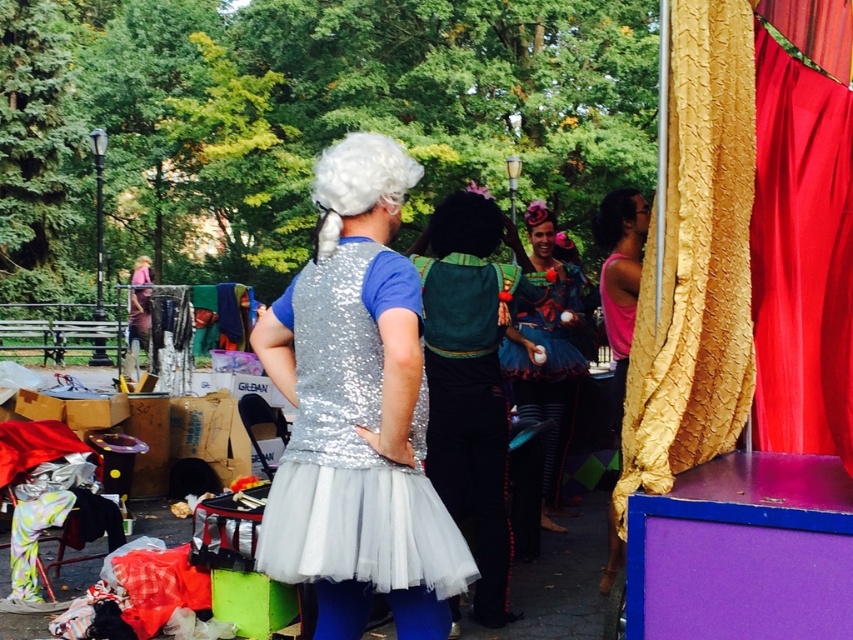
Does shiny blue tulle skirt at center appear on the right side of white curly wig at upper center?

Yes, shiny blue tulle skirt at center is to the right of white curly wig at upper center.

Which of these two, shiny blue tulle skirt at center or white curly wig at upper center, stands taller?

white curly wig at upper center

Image resolution: width=853 pixels, height=640 pixels. Describe the element at coordinates (546, 349) in the screenshot. I see `shiny blue tulle skirt at center` at that location.

This screenshot has height=640, width=853. In order to click on shiny blue tulle skirt at center in this screenshot , I will do point(546,349).

Between point (389, 310) and point (630, 205), which one is positioned behind?

The point (630, 205) is behind.

Which is more to the right, shiny silver dress at center or black sequined wig at upper right?

black sequined wig at upper right

Which is behind, point (317, 356) or point (610, 192)?

Positioned behind is point (610, 192).

Identify the location of shiny silver dress at center. The width and height of the screenshot is (853, 640). (357, 412).

Can you confirm if red velvet curtain at upper right is positioned below black sequined wig at upper right?

Yes, red velvet curtain at upper right is below black sequined wig at upper right.

Between red velvet curtain at upper right and black sequined wig at upper right, which one is positioned higher?

Positioned higher is black sequined wig at upper right.

At what (x,y) coordinates should I click in order to perform the action: click on red velvet curtain at upper right. Please return your answer as a coordinate pair (x, y). The height and width of the screenshot is (640, 853). Looking at the image, I should click on (801, 257).